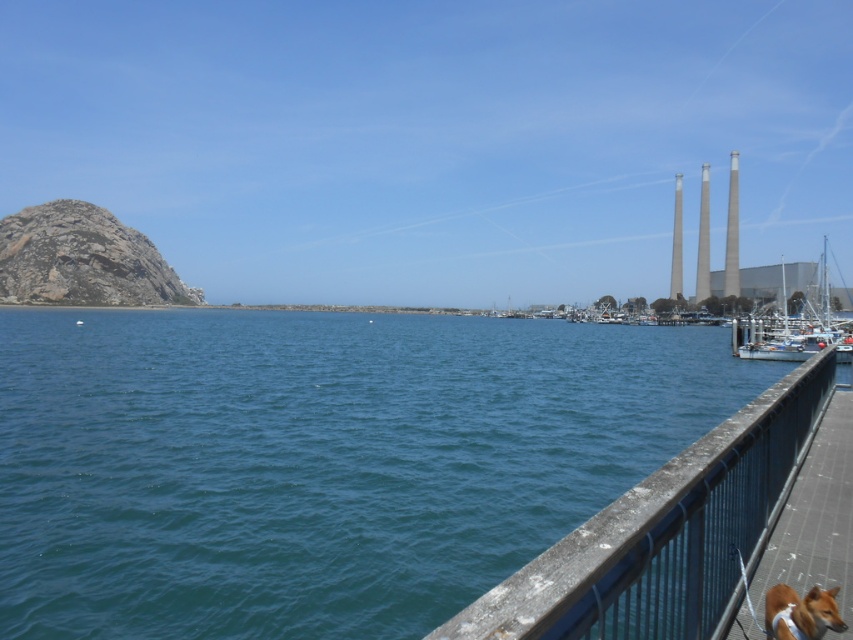
Question: Among these points, which one is farthest from the camera?

Choices:
 (A) (256, 577)
 (B) (815, 628)
 (C) (799, 321)

Answer: (C)

Question: Does rusty metal railing at lower right lie behind smooth metal dock at lower right?

Choices:
 (A) yes
 (B) no

Answer: (B)

Question: Which object is farther from the camera taking this photo?

Choices:
 (A) white glossy boat at right
 (B) brown fur dog at lower right
 (C) blue water at center

Answer: (A)

Question: Can you confirm if smooth metal dock at lower right is wider than brown fur dog at lower right?

Choices:
 (A) yes
 (B) no

Answer: (A)

Question: Which point is closer to the camera?

Choices:
 (A) smooth metal dock at lower right
 (B) white glossy boat at right

Answer: (A)

Question: Can you confirm if rusty metal railing at lower right is positioned to the left of white glossy boat at right?

Choices:
 (A) yes
 (B) no

Answer: (A)